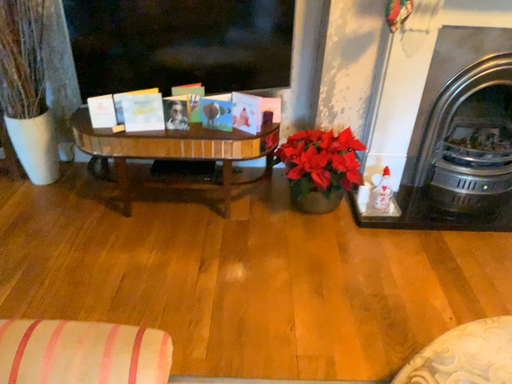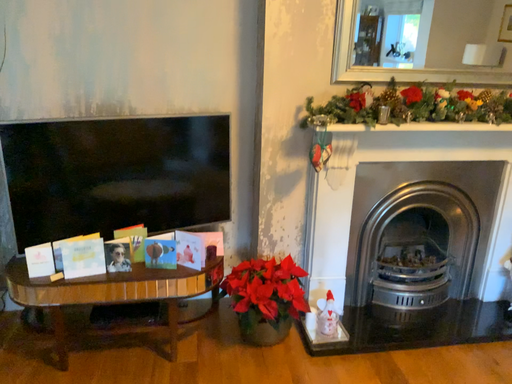
Question: How did the camera likely rotate when shooting the video?

Choices:
 (A) rotated upward
 (B) rotated downward

Answer: (A)